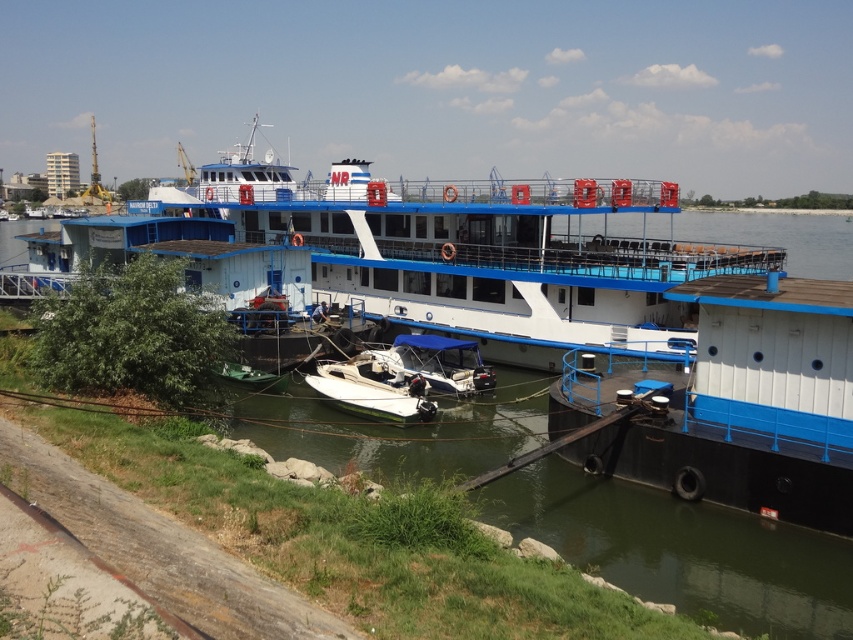
Between white glossy boat at center and blue canvas boat at center, which one appears on the right side from the viewer's perspective?

Positioned to the right is blue canvas boat at center.

Can you confirm if white glossy boat at center is positioned below blue canvas boat at center?

Correct, white glossy boat at center is located below blue canvas boat at center.

Who is more forward, (370, 404) or (466, 392)?

Point (370, 404) is in front.

Locate an element on the screen. This screenshot has width=853, height=640. white glossy boat at center is located at coordinates (374, 388).

Who is more forward, (689, 305) or (305, 380)?

Point (305, 380) is in front.

Can you confirm if white painted wood cabin at lower right is positioned to the right of white glossy boat at center?

Yes, white painted wood cabin at lower right is to the right of white glossy boat at center.

At what (x,y) coordinates should I click in order to perform the action: click on white painted wood cabin at lower right. Please return your answer as a coordinate pair (x, y). Looking at the image, I should click on (734, 403).

You are a GUI agent. You are given a task and a screenshot of the screen. Output one action in this format:
    pyautogui.click(x=<x>, y=<y>)
    Task: Click on the white painted wood cabin at lower right
    
    Given the screenshot: What is the action you would take?
    pyautogui.click(x=734, y=403)

Which of these two, white painted wood cabin at lower right or blue canvas boat at center, stands taller?

With more height is blue canvas boat at center.

Is point (766, 513) farther from camera compared to point (383, 356)?

That is False.

At what (x,y) coordinates should I click in order to perform the action: click on white painted wood cabin at lower right. Please return your answer as a coordinate pair (x, y). Looking at the image, I should click on (734, 403).